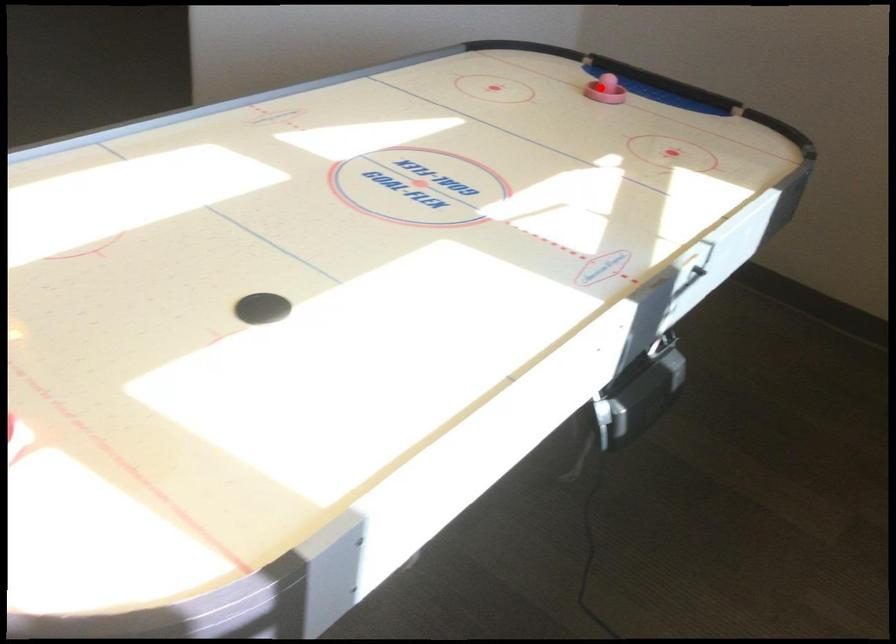
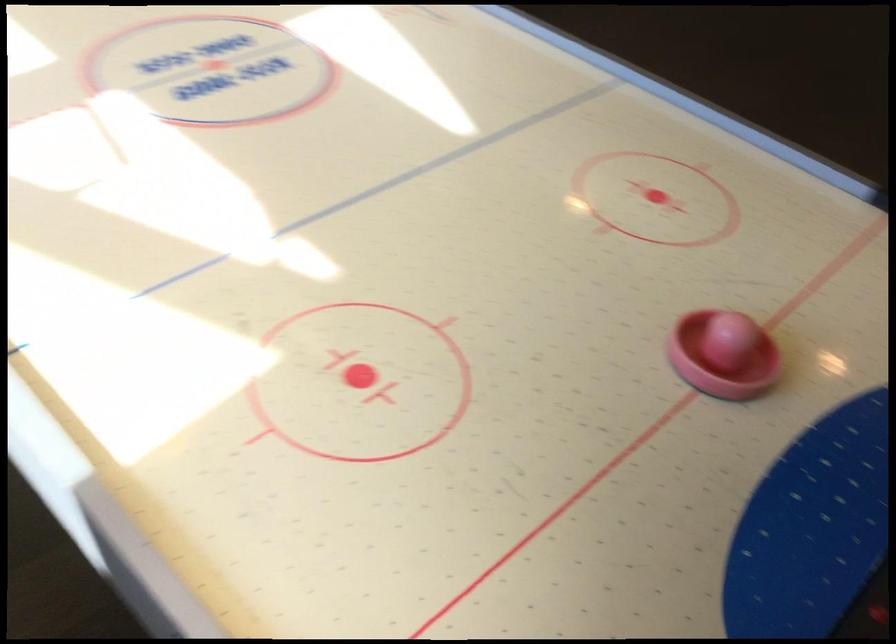
Where in the second image is the point corresponding to the highlighted location from the first image?

(722, 355)